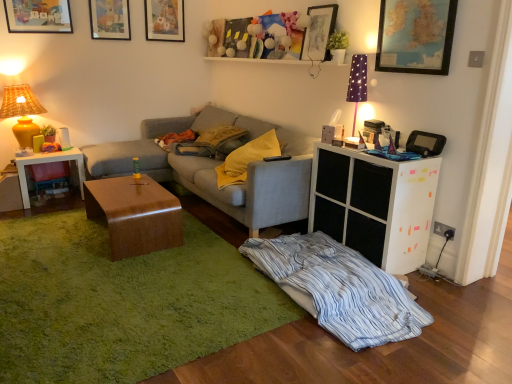
Question: Is wooden picture frame at upper center, which is counted as the second picture frame, starting from the front, inside the boundaries of matte wooden picture frame at upper left, marked as the 3th picture frame in a back-to-front arrangement, or outside?

Choices:
 (A) inside
 (B) outside

Answer: (B)

Question: Based on their sizes in the image, would you say wooden picture frame at upper center, placed as the fourth picture frame when sorted from left to right, is bigger or smaller than matte wooden picture frame at upper left, marked as the third picture frame in a front-to-back arrangement?

Choices:
 (A) small
 (B) big

Answer: (B)

Question: Considering the real-world distances, which object is closest to the purple fabric lampshade at upper right, placed as the first table lamp when sorted from right to left?

Choices:
 (A) white plastic side table at left
 (B) matte gray couch at center
 (C) blue striped fabric at lower center
 (D) matte wooden picture frame at upper center, the 1th picture frame from the back
 (E) green shaggy rug at center

Answer: (B)

Question: Which is farther from the yellow fabric pillow at center, which is the 1th pillow from back to front?

Choices:
 (A) white matte cabinet at right
 (B) matte paper picture frame at upper center, positioned as the fourth picture frame in front-to-back order
 (C) white plastic side table at left
 (D) matte yellow ceramic lamp at left, the first table lamp in the back-to-front sequence
 (E) blue striped fabric at lower center

Answer: (E)